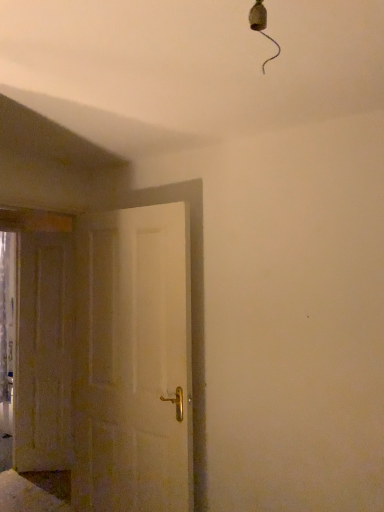
Question: Relative to wooden door at left, the second door when ordered from right to left, is white matte door at center, the second door when ordered from left to right, in front or behind?

Choices:
 (A) behind
 (B) front

Answer: (B)

Question: From their relative heights in the image, would you say white matte door at center, the second door when ordered from left to right, is taller or shorter than wooden door at left, which appears as the first door when viewed from the back?

Choices:
 (A) tall
 (B) short

Answer: (B)

Question: Is point (74, 389) closer or farther from the camera than point (14, 385)?

Choices:
 (A) farther
 (B) closer

Answer: (B)

Question: From the image's perspective, is wooden door at left, which appears as the first door when viewed from the back, positioned above or below white matte door at center, which is the first door in front-to-back order?

Choices:
 (A) above
 (B) below

Answer: (B)

Question: From a real-world perspective, relative to white matte door at center, acting as the 1th door starting from the right, is wooden door at left, which appears as the first door when viewed from the back, vertically above or below?

Choices:
 (A) below
 (B) above

Answer: (A)

Question: Considering the positions of wooden door at left, the first door when ordered from left to right, and white matte door at center, the second door when ordered from left to right, in the image, is wooden door at left, the first door when ordered from left to right, taller or shorter than white matte door at center, the second door when ordered from left to right,?

Choices:
 (A) short
 (B) tall

Answer: (B)

Question: Considering the positions of point (51, 303) and point (125, 311), is point (51, 303) closer or farther from the camera than point (125, 311)?

Choices:
 (A) closer
 (B) farther

Answer: (B)